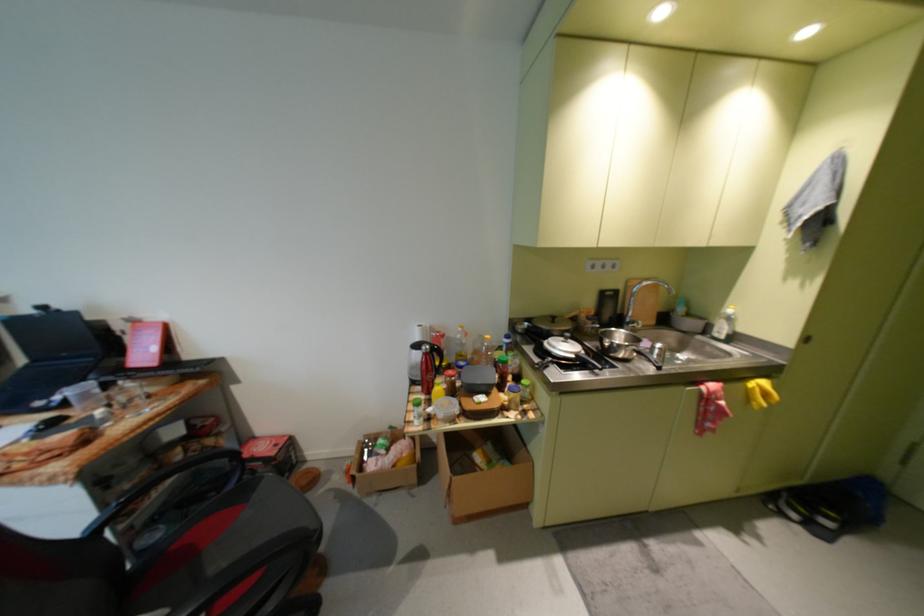
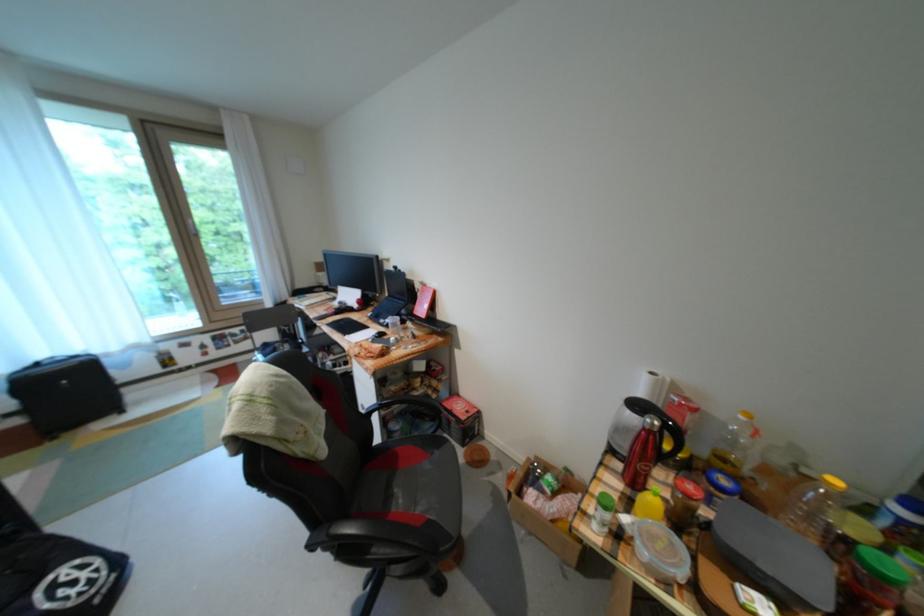
Find the pixel in the second image that matches point (438, 398) in the first image.

(639, 493)